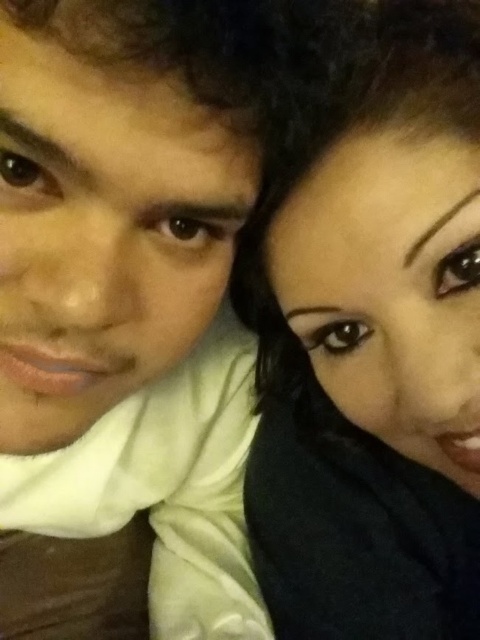
Consider the image. You are standing in front of the two people in the image. Which of the two points, point (207, 276) or point (408, 211), is closer to you?

Point (408, 211) is closer to you because it is in front of point (207, 276).

You are a photographer adjusting the framing of this image. You need to ensure both the matte white scarf at upper left and the black matte hair at upper right are visible in the frame. Given the current composition, which object might require more space in the frame to accommodate its size?

The matte white scarf at upper left requires more space in the frame because its width is larger than the black matte hair at upper right.

You are a photographer adjusting the focus on your camera. You want to ensure that both the matte white scarf at upper left and the black matte hair at upper right are in sharp focus. Which object should you focus on first to achieve this?

You should focus on the matte white scarf at upper left first because it is closer to the viewer than the black matte hair at upper right. By focusing on the closer object, the depth of field may extend to include the farther object in acceptable focus.